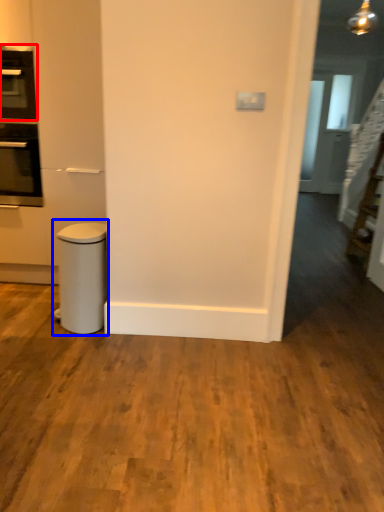
Question: Among these objects, which one is nearest to the camera, home appliance (highlighted by a red box) or waste container (highlighted by a blue box)?

Choices:
 (A) home appliance
 (B) waste container

Answer: (B)